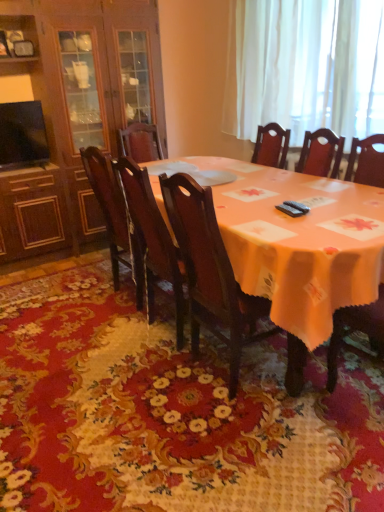
This screenshot has height=512, width=384. Find the location of `free location in front of dark wood chair at center, which is counted as the 2th chair, starting from the right`. free location in front of dark wood chair at center, which is counted as the 2th chair, starting from the right is located at coordinates (152, 383).